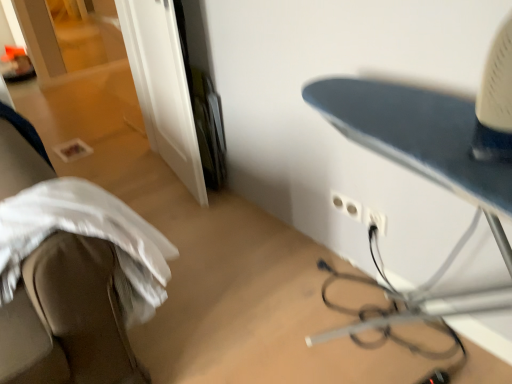
Question: Considering the relative sizes of white plastic electric outlet at center-right, which ranks as the 2th electric outlet in left-to-right order, and white plastic electric outlet at lower right, the 1th electric outlet viewed from the left, in the image provided, is white plastic electric outlet at center-right, which ranks as the 2th electric outlet in left-to-right order, thinner than white plastic electric outlet at lower right, the 1th electric outlet viewed from the left,?

Choices:
 (A) no
 (B) yes

Answer: (A)

Question: Is white plastic electric outlet at lower right, the 1th electric outlet viewed from the left, a part of white plastic electric outlet at center-right, the 1th electric outlet positioned from the right?

Choices:
 (A) no
 (B) yes

Answer: (A)

Question: From a real-world perspective, is white plastic electric outlet at center-right, which ranks as the 2th electric outlet in left-to-right order, under white plastic electric outlet at lower right, the second electric outlet viewed from the right?

Choices:
 (A) yes
 (B) no

Answer: (B)

Question: Can you confirm if white plastic electric outlet at center-right, which ranks as the 2th electric outlet in left-to-right order, is taller than white plastic electric outlet at lower right, the second electric outlet viewed from the right?

Choices:
 (A) yes
 (B) no

Answer: (A)

Question: Is white plastic electric outlet at center-right, the 1th electric outlet positioned from the right, oriented towards white plastic electric outlet at lower right, the second electric outlet viewed from the right?

Choices:
 (A) no
 (B) yes

Answer: (A)

Question: Is white plastic electric outlet at lower right, the 1th electric outlet viewed from the left, taller or shorter than white fabric at left?

Choices:
 (A) tall
 (B) short

Answer: (B)

Question: Is white plastic electric outlet at lower right, the 1th electric outlet viewed from the left, in front of or behind white fabric at left in the image?

Choices:
 (A) front
 (B) behind

Answer: (B)

Question: From a real-world perspective, is white plastic electric outlet at lower right, the second electric outlet viewed from the right, physically located above or below white fabric at left?

Choices:
 (A) below
 (B) above

Answer: (A)

Question: From the image's perspective, is white plastic electric outlet at lower right, the 1th electric outlet viewed from the left, above or below white fabric at left?

Choices:
 (A) above
 (B) below

Answer: (A)

Question: In terms of height, does white plastic electric outlet at lower right, the second electric outlet viewed from the right, look taller or shorter compared to blue metallic ironing board at right?

Choices:
 (A) short
 (B) tall

Answer: (A)

Question: In terms of width, does white plastic electric outlet at lower right, the 1th electric outlet viewed from the left, look wider or thinner when compared to blue metallic ironing board at right?

Choices:
 (A) wide
 (B) thin

Answer: (B)

Question: Considering their positions, is white plastic electric outlet at lower right, the second electric outlet viewed from the right, located in front of or behind blue metallic ironing board at right?

Choices:
 (A) behind
 (B) front

Answer: (A)

Question: Based on their positions, is white plastic electric outlet at lower right, the 1th electric outlet viewed from the left, located to the left or right of blue metallic ironing board at right?

Choices:
 (A) right
 (B) left

Answer: (B)

Question: Considering the positions of white plastic electric outlet at lower right, the 1th electric outlet viewed from the left, and white plastic electric outlet at center-right, the 1th electric outlet positioned from the right, in the image, is white plastic electric outlet at lower right, the 1th electric outlet viewed from the left, bigger or smaller than white plastic electric outlet at center-right, the 1th electric outlet positioned from the right,?

Choices:
 (A) small
 (B) big

Answer: (A)

Question: From their relative heights in the image, would you say white plastic electric outlet at lower right, the 1th electric outlet viewed from the left, is taller or shorter than white plastic electric outlet at center-right, which ranks as the 2th electric outlet in left-to-right order?

Choices:
 (A) tall
 (B) short

Answer: (B)